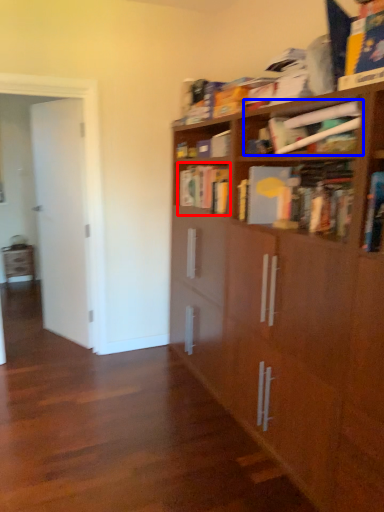
Question: Which point is closer to the camera, book (highlighted by a red box) or book (highlighted by a blue box)?

Choices:
 (A) book
 (B) book

Answer: (B)